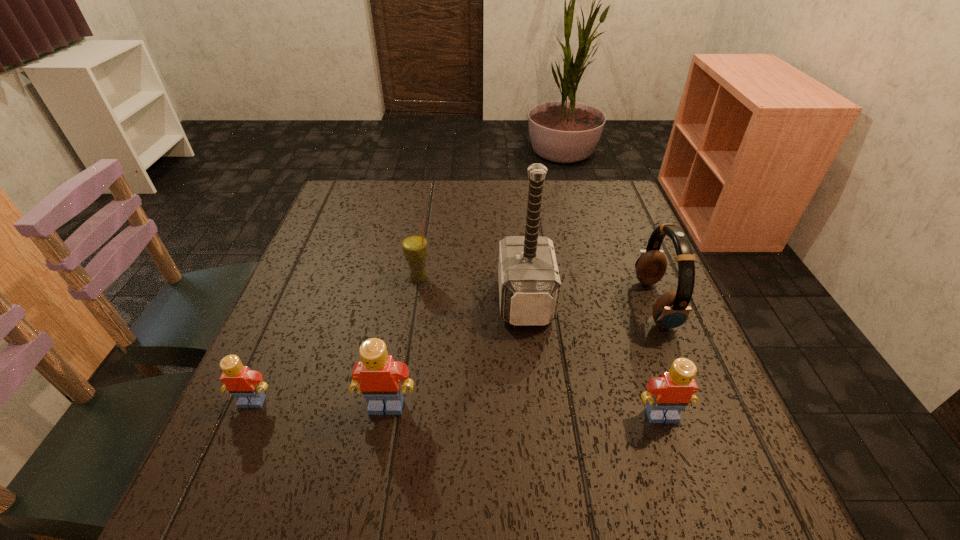
At what (x,y) coordinates should I click in order to perform the action: click on free region located on the ear cup of the headset. Please return your answer as a coordinate pair (x, y). Image resolution: width=960 pixels, height=540 pixels. Looking at the image, I should click on (569, 304).

At what (x,y) coordinates should I click in order to perform the action: click on vacant space located on the ear cup of the headset. Please return your answer as a coordinate pair (x, y). Looking at the image, I should click on (547, 304).

The width and height of the screenshot is (960, 540). Identify the location of vacant point located on the ear cup of the headset. (508, 304).

Identify the location of vacant space located on the front of the straw for drinking. (403, 379).

You are a GUI agent. You are given a task and a screenshot of the screen. Output one action in this format:
    pyautogui.click(x=<x>, y=<y>)
    Task: Click on the vacant space located 0.260m for striking with the head of the third object from right to left
    This screenshot has width=960, height=540.
    Given the screenshot: What is the action you would take?
    pyautogui.click(x=385, y=300)

Identify the location of blank space located 0.110m for striking with the head of the third object from right to left. The image size is (960, 540). (451, 300).

Find the location of `free location located for striking with the head of the third object from right to left`. free location located for striking with the head of the third object from right to left is located at coordinates (407, 300).

Identify the location of object that is positioned at the left edge. The height and width of the screenshot is (540, 960). (246, 385).

Locate an element on the screen. The image size is (960, 540). Lego at the right edge is located at coordinates (667, 395).

The width and height of the screenshot is (960, 540). I want to click on headset situated at the right edge, so (x=671, y=310).